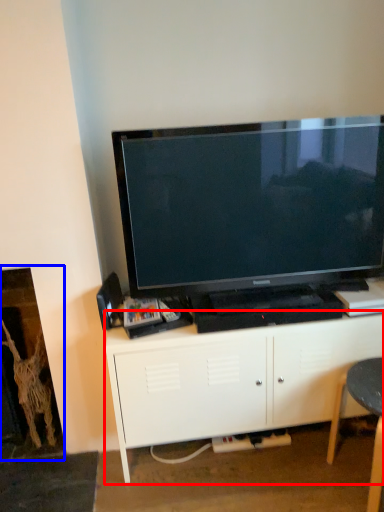
Question: Which point is closer to the camera, cabinetry (highlighted by a red box) or fireplace (highlighted by a blue box)?

Choices:
 (A) cabinetry
 (B) fireplace

Answer: (A)